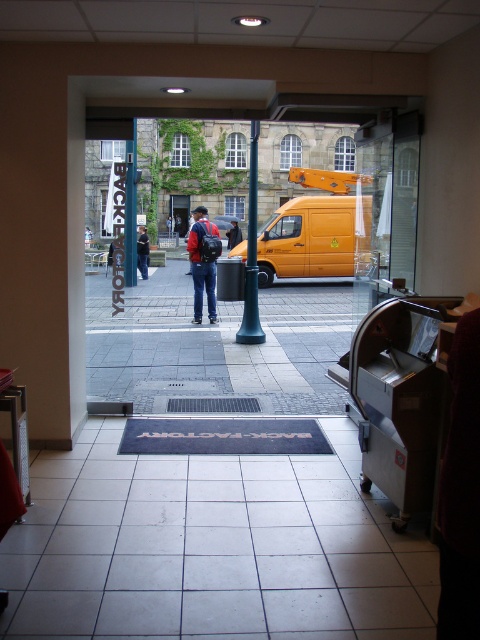
Question: Is white tile pavement at center closer to camera compared to dark blue jeans at center?

Choices:
 (A) no
 (B) yes

Answer: (B)

Question: Does green polished metal pole at center have a smaller size compared to dark blue jeans at center?

Choices:
 (A) no
 (B) yes

Answer: (A)

Question: Among these points, which one is nearest to the camera?

Choices:
 (A) (249, 241)
 (B) (197, 214)

Answer: (A)

Question: Among these points, which one is nearest to the camera?

Choices:
 (A) (231, 244)
 (B) (324, 378)
 (C) (250, 147)

Answer: (B)

Question: Is red backpack at center positioned in front of dark blue jeans at center?

Choices:
 (A) yes
 (B) no

Answer: (A)

Question: Estimate the real-world distances between objects in this image. Which object is farther from the gray tile pavement at center?

Choices:
 (A) matte red backpack at center
 (B) dark blue jeans at center
 (C) red backpack at center

Answer: (B)